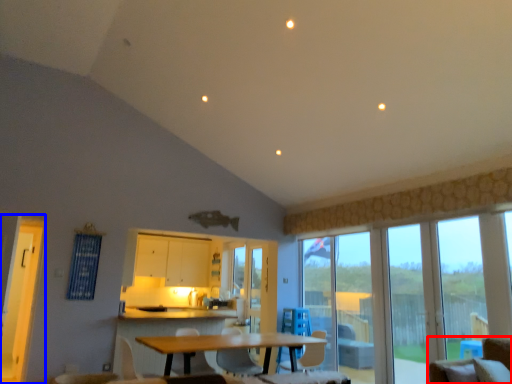
Question: Which object is closer to the camera taking this photo, chair (highlighted by a red box) or screen door (highlighted by a blue box)?

Choices:
 (A) chair
 (B) screen door

Answer: (A)